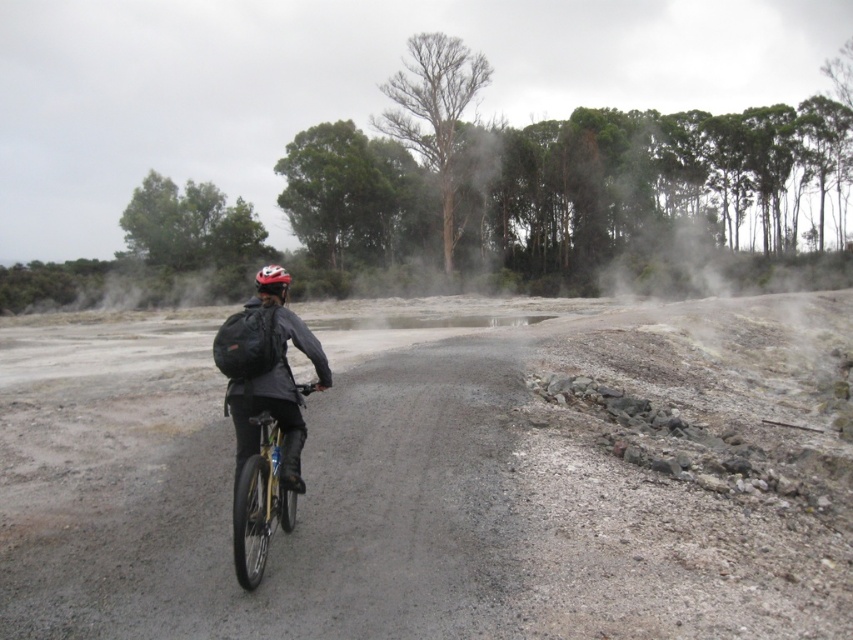
Question: Which of these objects is positioned closest to the gold metallic bicycle at center?

Choices:
 (A) matte black jacket at center
 (B) gray gravel road at center

Answer: (A)

Question: In this image, where is matte black jacket at center located relative to gold metallic bicycle at center?

Choices:
 (A) right
 (B) left

Answer: (B)

Question: Can you confirm if gray gravel road at center is positioned to the right of gold metallic bicycle at center?

Choices:
 (A) yes
 (B) no

Answer: (A)

Question: Among these points, which one is nearest to the camera?

Choices:
 (A) (267, 508)
 (B) (242, 436)
 (C) (503, 332)
 (D) (257, 276)

Answer: (A)

Question: Which point is farther to the camera?

Choices:
 (A) gold metallic bicycle at center
 (B) gray gravel road at center
 (C) matte black helmet at center

Answer: (C)

Question: Is matte black jacket at center below matte black helmet at center?

Choices:
 (A) no
 (B) yes

Answer: (B)